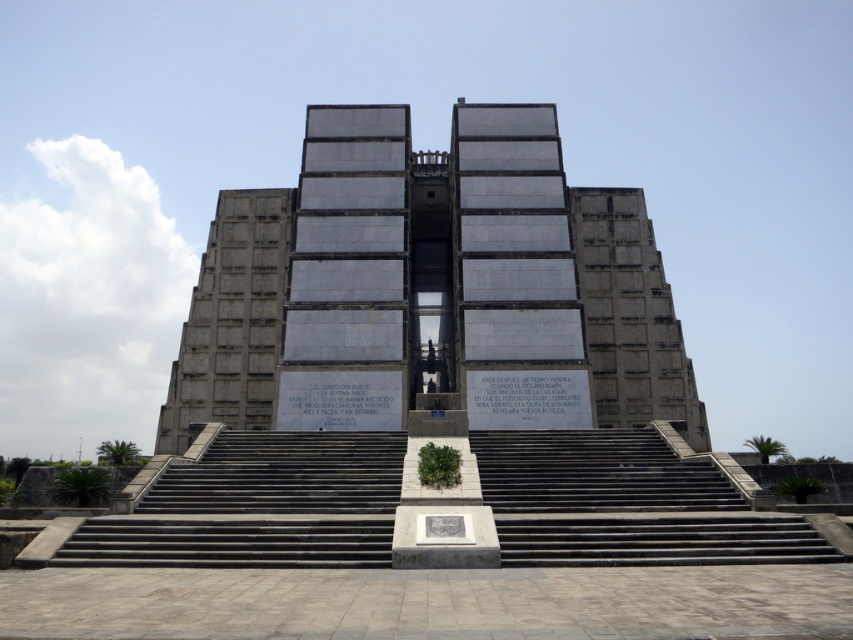
Question: Which object appears farthest from the camera in this image?

Choices:
 (A) gray concrete pyramid at center
 (B) gray concrete stairs at center

Answer: (A)

Question: Can you confirm if gray concrete pyramid at center is positioned to the left of gray concrete stairs at center?

Choices:
 (A) yes
 (B) no

Answer: (A)

Question: Which of the following is the farthest from the observer?

Choices:
 (A) (380, 368)
 (B) (199, 522)

Answer: (A)

Question: Which object is closer to the camera taking this photo?

Choices:
 (A) gray concrete stairs at center
 (B) gray concrete pyramid at center

Answer: (A)

Question: Is gray concrete pyramid at center positioned before gray concrete stairs at center?

Choices:
 (A) yes
 (B) no

Answer: (B)

Question: Does gray concrete pyramid at center appear on the left side of gray concrete stairs at center?

Choices:
 (A) no
 (B) yes

Answer: (B)